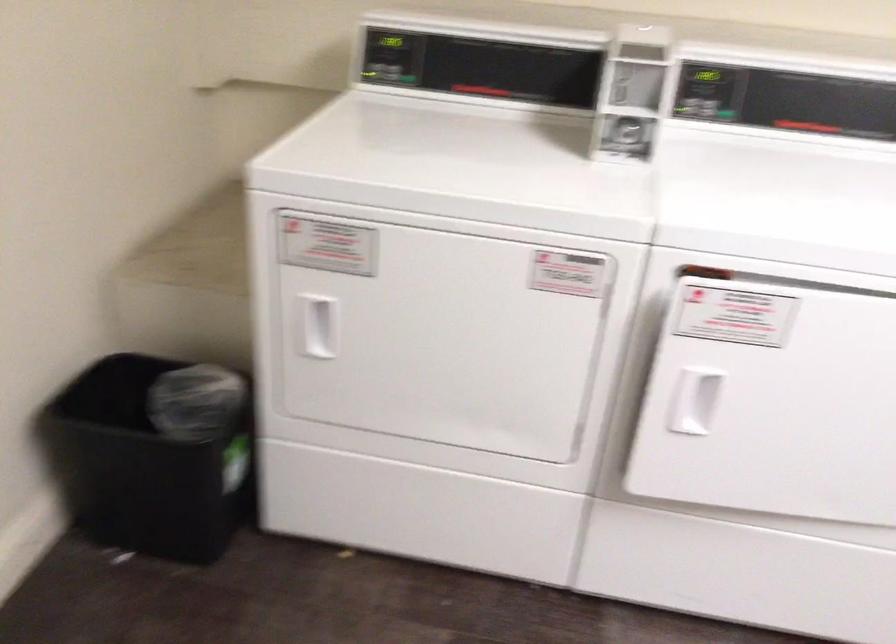
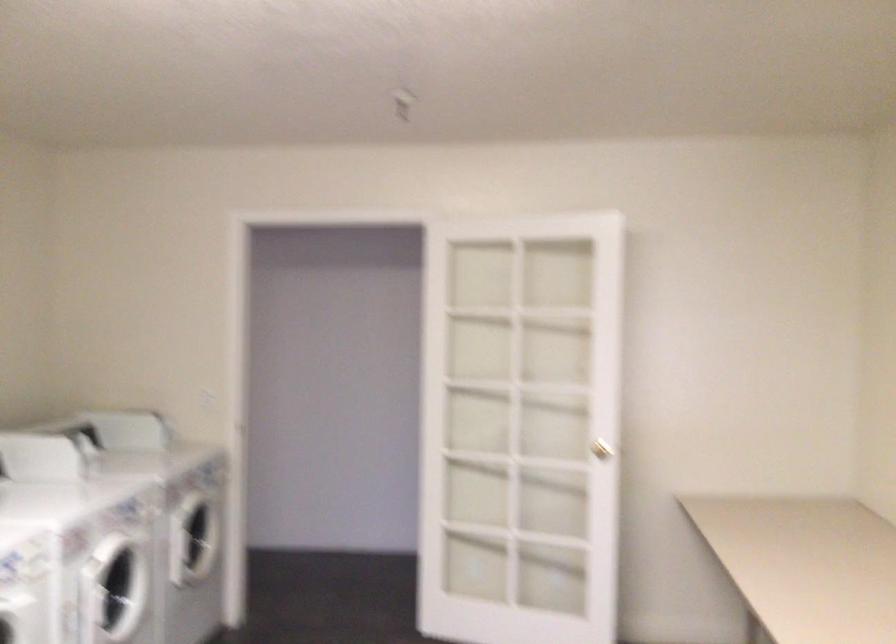
Question: How did the camera likely rotate?

Choices:
 (A) Left
 (B) Right
 (C) Up
 (D) Down

Answer: (B)